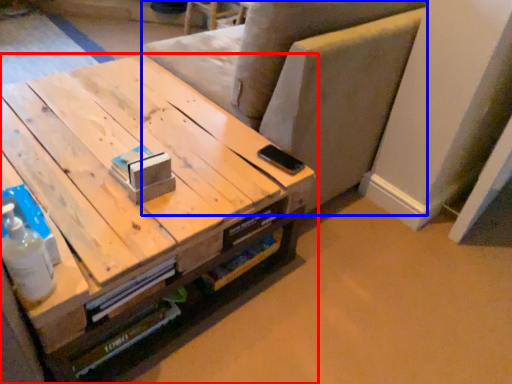
Question: Which of the following is the farthest to the observer, table (highlighted by a red box) or armchair (highlighted by a blue box)?

Choices:
 (A) table
 (B) armchair

Answer: (B)